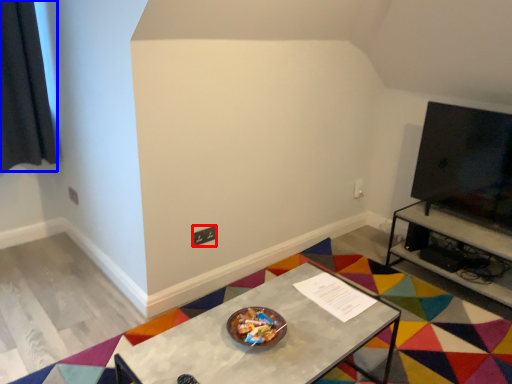
Question: Among these objects, which one is nearest to the camera, square (highlighted by a red box) or curtain (highlighted by a blue box)?

Choices:
 (A) square
 (B) curtain

Answer: (B)